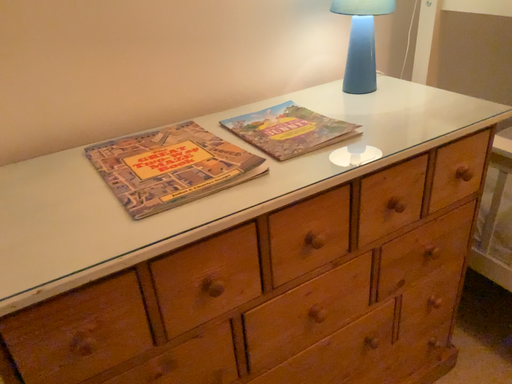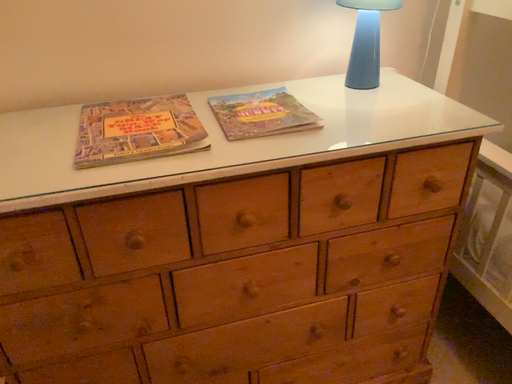
Question: How did the camera likely rotate when shooting the video?

Choices:
 (A) rotated right
 (B) rotated left

Answer: (B)